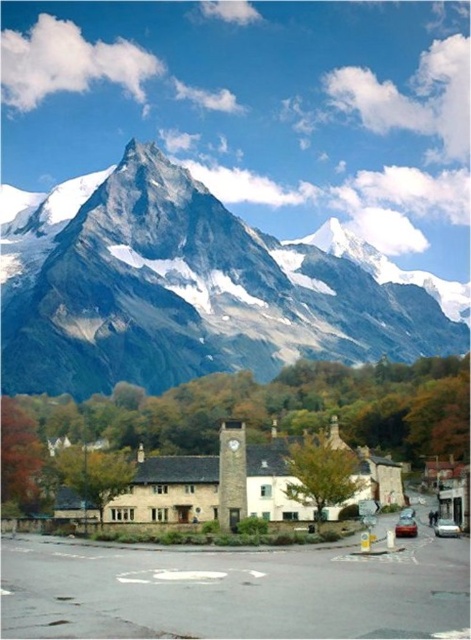
You are an architect planning to build a new observation deck that must be visible from both the rocky gray mountain range at upper center and the smooth stone clock tower at center. Based on their positions, where should the observation deck be placed to ensure visibility from both landmarks?

The observation deck should be placed in a location that is between or in front of the rocky gray mountain range at upper center and the smooth stone clock tower at center, ensuring it is visible from both. Since the mountain range is above the clock tower, positioning it in the foreground or midground would allow both landmarks to have a clear line of sight.

From the picture: You are standing at the base of the mountains in the village and want to reach the point marked as point (186, 291) on the rocky gray mountain range at upper center. Considering the steepness of the mountain, do you think it is safe to climb directly upwards from your current position to reach that point?

The point (186, 291) is on the rocky gray mountain range at upper center, which is described as steep and rugged. Climbing directly upwards from the village base might be dangerous due to the steep terrain, so it is advisable to take a safer, less steep path instead.

You are an artist planning to paint the mountain village scene. You want to ensure that the two points in the image, point (x=228, y=435) and point (x=397, y=529), are accurately represented in terms of depth. Which point should you place closer to the front of your painting to maintain the scene depth?

Point (x=228, y=435) is closer to the viewer than point (x=397, y=529), so you should place point (x=228, y=435) closer to the front of the painting to maintain the scene depth.